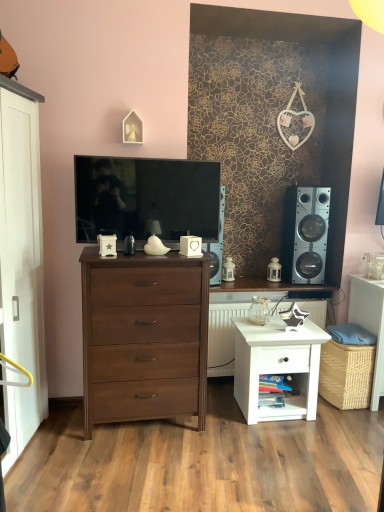
Locate an element on the screen. free location in front of dark wood chest of drawers at center is located at coordinates (132, 464).